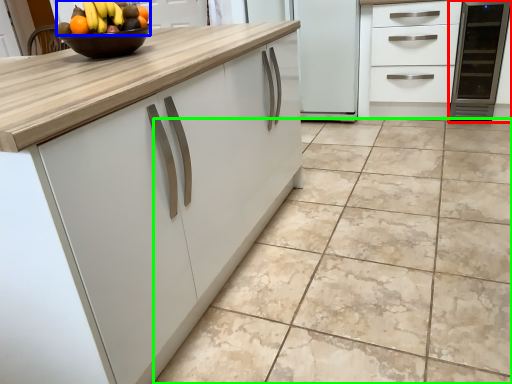
Question: Based on their relative distances, which object is nearer to appliance (highlighted by a red box)? Choose from grapefruit (highlighted by a blue box) and ceramic tile (highlighted by a green box).

Choices:
 (A) grapefruit
 (B) ceramic tile

Answer: (B)